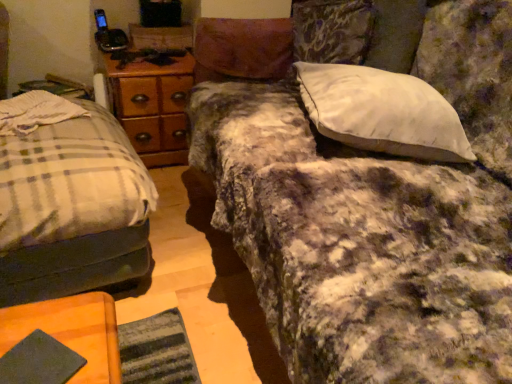
Question: Is wooden at left looking in the opposite direction of dark green fabric at lower left?

Choices:
 (A) yes
 (B) no

Answer: (B)

Question: Is wooden at left taller than dark green fabric at lower left?

Choices:
 (A) no
 (B) yes

Answer: (B)

Question: Can you confirm if wooden at left is thinner than dark green fabric at lower left?

Choices:
 (A) yes
 (B) no

Answer: (B)

Question: Can you confirm if wooden at left is positioned to the left of dark green fabric at lower left?

Choices:
 (A) yes
 (B) no

Answer: (A)

Question: Does wooden at left have a smaller size compared to dark green fabric at lower left?

Choices:
 (A) yes
 (B) no

Answer: (B)

Question: Can you confirm if wooden at left is bigger than dark green fabric at lower left?

Choices:
 (A) no
 (B) yes

Answer: (B)

Question: Is dark green fabric at lower left completely or partially inside white soft pillow at upper right?

Choices:
 (A) yes
 (B) no

Answer: (B)

Question: Is white soft pillow at upper right outside dark green fabric at lower left?

Choices:
 (A) yes
 (B) no

Answer: (A)

Question: Is white soft pillow at upper right thinner than dark green fabric at lower left?

Choices:
 (A) yes
 (B) no

Answer: (B)

Question: Is white soft pillow at upper right not near dark green fabric at lower left?

Choices:
 (A) no
 (B) yes

Answer: (A)

Question: Is white soft pillow at upper right at the left side of dark green fabric at lower left?

Choices:
 (A) no
 (B) yes

Answer: (A)

Question: From a real-world perspective, is white soft pillow at upper right below dark green fabric at lower left?

Choices:
 (A) no
 (B) yes

Answer: (A)

Question: From a real-world perspective, is white soft pillow at upper right physically above plaid fabric bed at left?

Choices:
 (A) no
 (B) yes

Answer: (B)